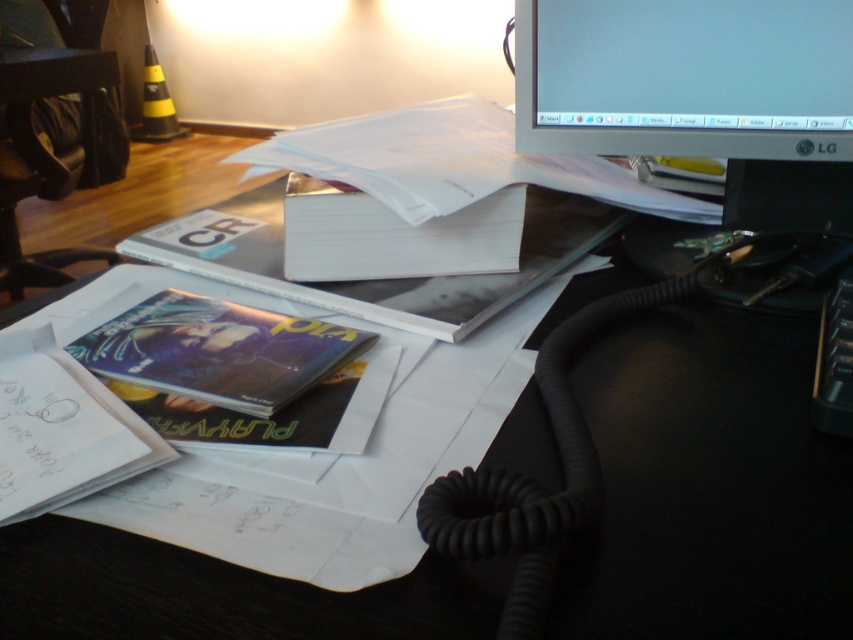
Question: Does matte plastic book at lower left appear over white paper book at center?

Choices:
 (A) yes
 (B) no

Answer: (B)

Question: In this image, where is metallic glossy book at center located relative to matte plastic book at lower left?

Choices:
 (A) right
 (B) left

Answer: (A)

Question: Which object is closer to the camera taking this photo?

Choices:
 (A) matte black monitor at upper right
 (B) matte black monitor at upper center
 (C) metallic glossy book at center

Answer: (B)

Question: Estimate the real-world distances between objects in this image. Which object is farther from the matte black monitor at upper center?

Choices:
 (A) white paper book at center
 (B) matte black monitor at upper right

Answer: (B)

Question: Which of the following is the closest to the observer?

Choices:
 (A) (321, 243)
 (B) (821, 48)
 (C) (286, 397)

Answer: (C)

Question: Is the position of matte plastic book at lower left more distant than that of white paper book at center?

Choices:
 (A) yes
 (B) no

Answer: (B)